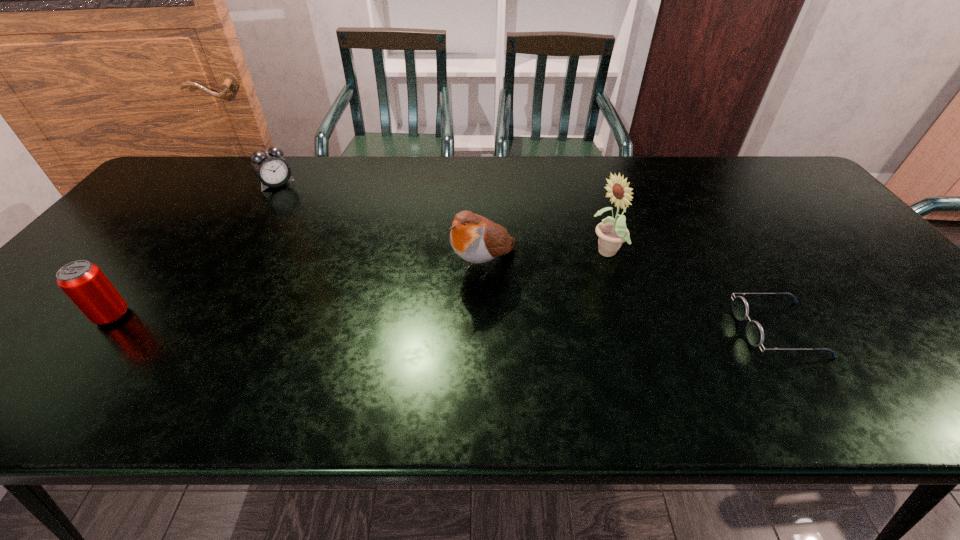
Identify the location of free space located 0.080m at the face of the third object from right to left. This screenshot has height=540, width=960. (443, 305).

Where is `free spot located at the face of the third object from right to left`? The width and height of the screenshot is (960, 540). free spot located at the face of the third object from right to left is located at coordinates (382, 357).

Locate an element on the screen. free space located at the face of the third object from right to left is located at coordinates (434, 313).

Identify the location of object that is at the far edge. Image resolution: width=960 pixels, height=540 pixels. (269, 166).

The height and width of the screenshot is (540, 960). Find the location of `object at the near edge`. object at the near edge is located at coordinates (754, 331).

Where is `object that is positioned at the left edge`? This screenshot has height=540, width=960. object that is positioned at the left edge is located at coordinates pos(84,283).

Locate an element on the screen. This screenshot has height=540, width=960. vacant space at the far edge of the desktop is located at coordinates (451, 155).

Locate an element on the screen. Image resolution: width=960 pixels, height=540 pixels. free space at the left edge of the desktop is located at coordinates (195, 198).

You are a GUI agent. You are given a task and a screenshot of the screen. Output one action in this format:
    pyautogui.click(x=<x>, y=<y>)
    Task: Click on the free space at the right edge of the desktop
    The height and width of the screenshot is (540, 960).
    Given the screenshot: What is the action you would take?
    pyautogui.click(x=770, y=199)

This screenshot has width=960, height=540. In the image, there is a desktop. Find the location of `vacant space at the far left corner`. vacant space at the far left corner is located at coordinates (184, 192).